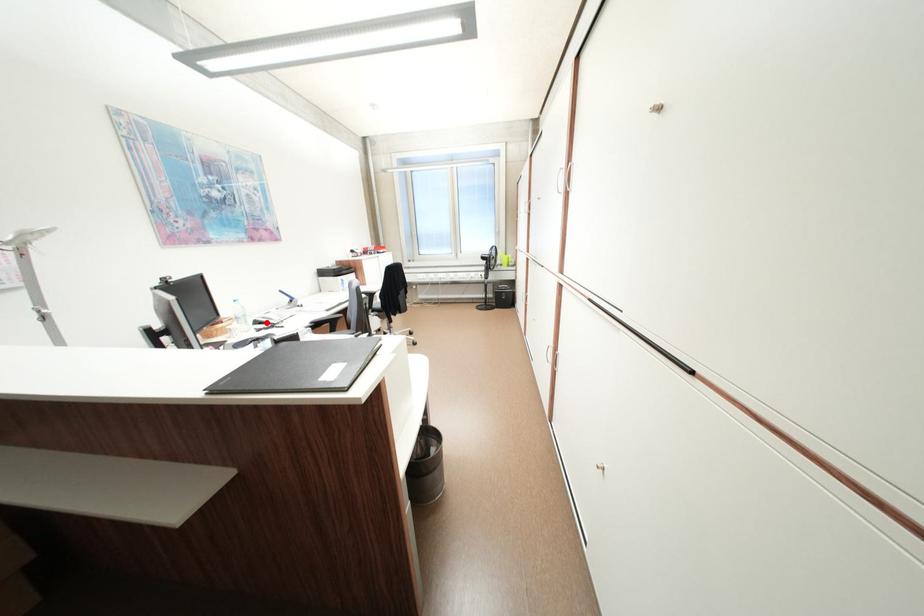
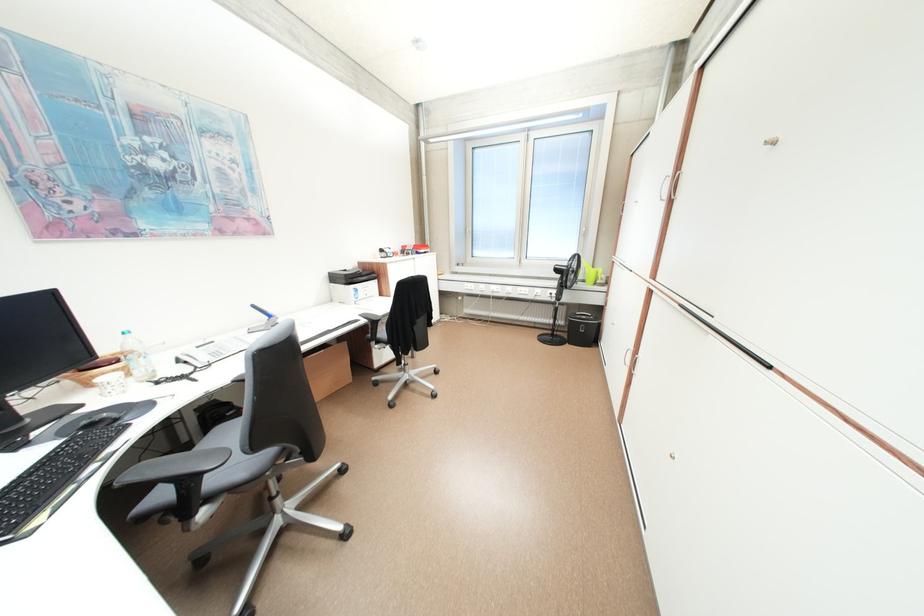
Locate, in the second image, the point that corresponds to the highlighted location in the first image.

(188, 362)